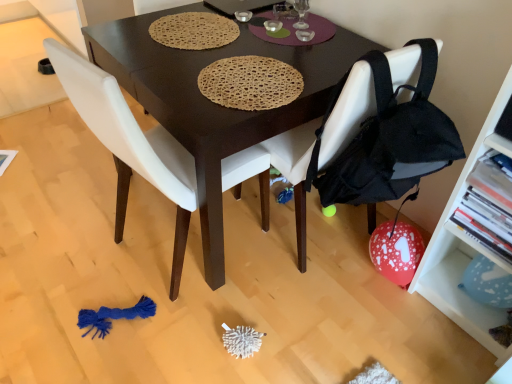
Question: From the image's perspective, is white matte chair at center, which ranks as the second chair in right-to-left order, positioned above or below dark brown wood desk at center?

Choices:
 (A) above
 (B) below

Answer: (B)

Question: Considering their positions, is white matte chair at center, marked as the 1th chair in a left-to-right arrangement, located in front of or behind dark brown wood desk at center?

Choices:
 (A) behind
 (B) front

Answer: (B)

Question: Which of these objects is positioned closest to the black fabric chair at lower right, acting as the first chair starting from the right?

Choices:
 (A) white matte shelf at right
 (B) dark brown wood desk at center
 (C) white matte chair at center, which ranks as the second chair in right-to-left order

Answer: (B)

Question: Based on their relative distances, which object is nearer to the white matte chair at center, marked as the 1th chair in a left-to-right arrangement?

Choices:
 (A) dark brown wood desk at center
 (B) white matte shelf at right
 (C) black fabric chair at lower right, acting as the first chair starting from the right

Answer: (A)